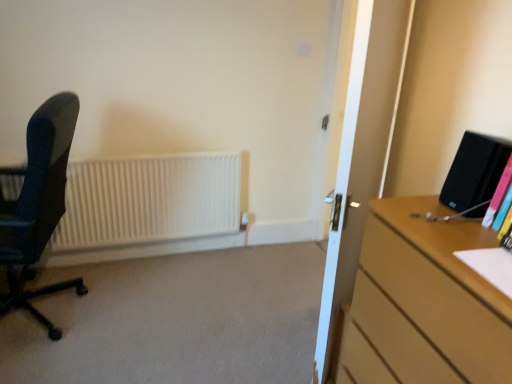
You are a GUI agent. You are given a task and a screenshot of the screen. Output one action in this format:
    pyautogui.click(x=<x>, y=<y>)
    Task: Click on the free space between transparent glass door at center and white matte radiator at left
    
    Given the screenshot: What is the action you would take?
    [229, 295]